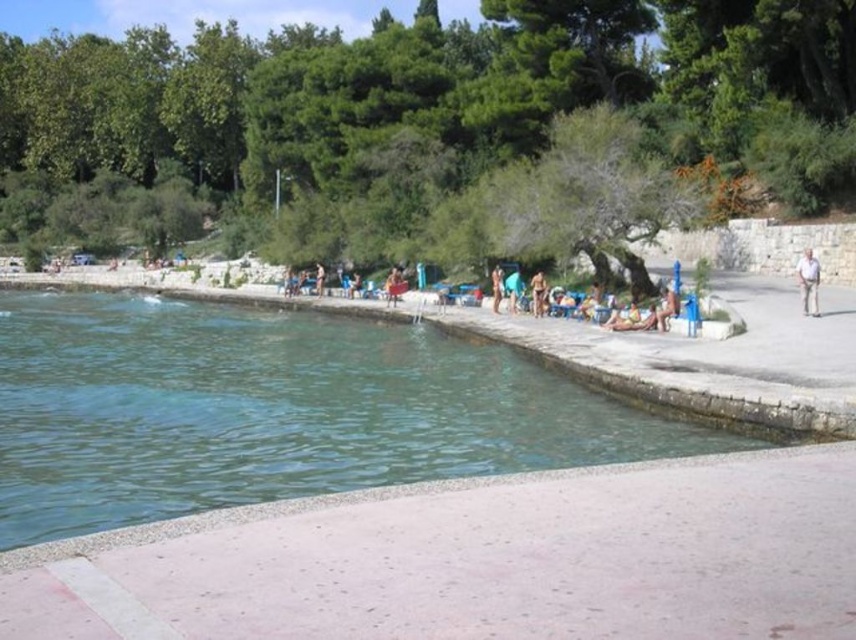
Question: Which of these objects is positioned farthest from the clear concrete pool at center?

Choices:
 (A) white cotton shirt at right
 (B) tan skin person at center
 (C) smooth concrete beach at center
 (D) beige fabric chair at center

Answer: (A)

Question: Considering the real-world distances, which object is closest to the beige fabric chair at center?

Choices:
 (A) blue fabric towel at center
 (B) white cotton shirt at right
 (C) tan skin person at center

Answer: (A)

Question: Which object appears closest to the camera in this image?

Choices:
 (A) tan skin person at center
 (B) white cotton shirt at right
 (C) blue fabric towel at center
 (D) beige fabric chair at center

Answer: (B)

Question: Is tan skin person at center further to the viewer compared to beige fabric chair at center?

Choices:
 (A) no
 (B) yes

Answer: (A)

Question: Is clear concrete pool at center closer to the viewer compared to beige fabric chair at center?

Choices:
 (A) no
 (B) yes

Answer: (B)

Question: Does clear concrete pool at center have a lesser width compared to smooth concrete beach at center?

Choices:
 (A) yes
 (B) no

Answer: (A)